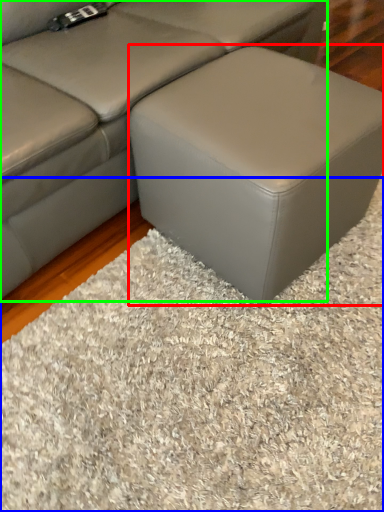
Question: Estimate the real-world distances between objects in this image. Which object is farther from stool (highlighted by a red box), mat (highlighted by a blue box) or studio couch (highlighted by a green box)?

Choices:
 (A) mat
 (B) studio couch

Answer: (A)